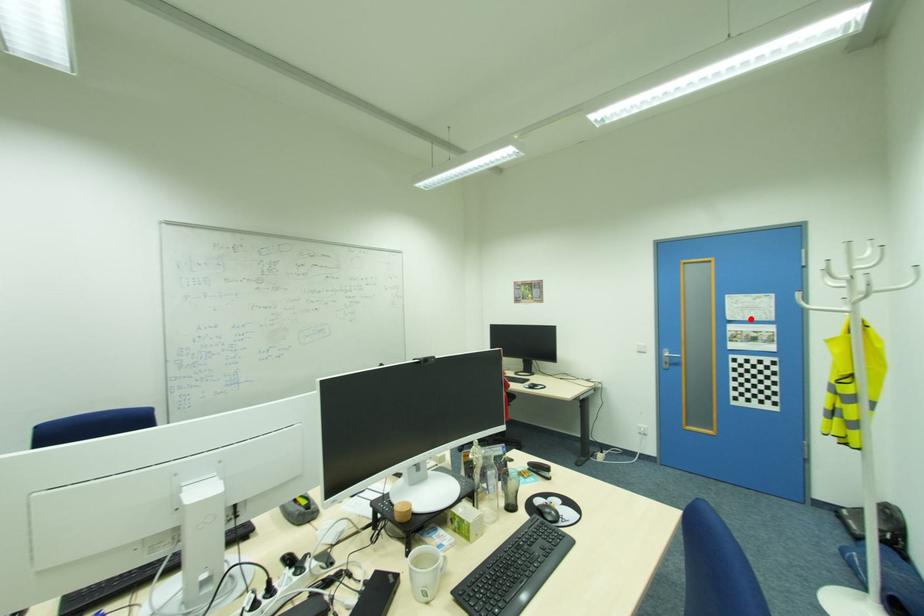
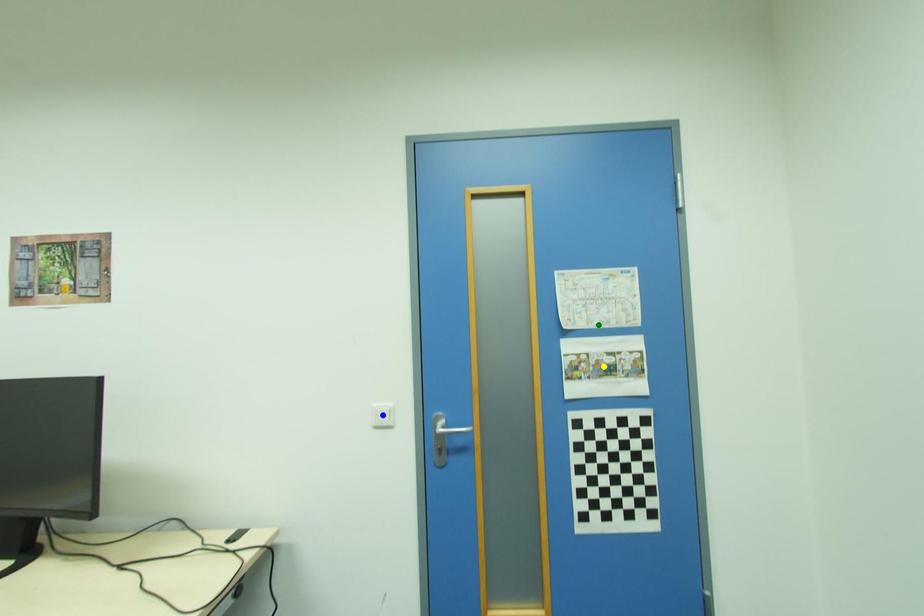
Question: I am providing you with two images of the same scene from different viewpoints. A red point is marked on the first image. You are given multiple points on the second image. Which spot in image 2 lines up with the point in image 1?

Choices:
 (A) yellow point
 (B) green point
 (C) blue point

Answer: (B)